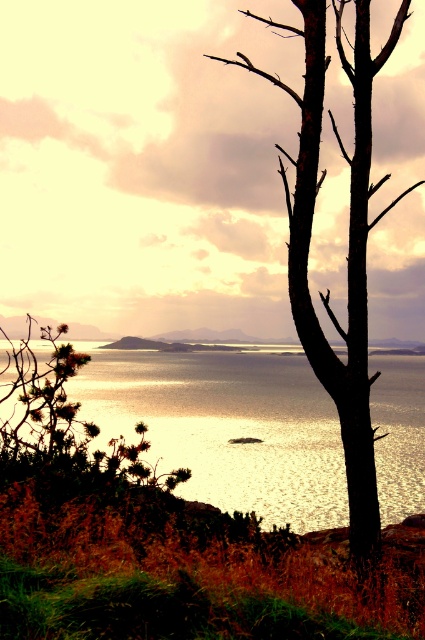
You are standing at the point marked by coordinates point (226, 428) in the coastal landscape scene. What do you see around you?

You are standing at the point marked by coordinates point (226, 428), which marks glistening reflective water at center. The water reflects the warm golden hues of the sky and the silhouette of the prominent dark trunk tree and the smaller green bush to the left of it.

You are standing at the point with coordinates point (x=345, y=448) and want to walk towards the horizon. Will the point point (x=240, y=477) block your view?

Point (x=240, y=477) is behind point (x=345, y=448), so it will not block your view.

You are a photographer trying to capture the reflection of the black bark tree at right in the glistening reflective water at center. Based on the scene, is the tree positioned in a way that its reflection would be visible in the water?

The glistening reflective water at center is located below the black bark tree at right, so the tree is positioned above the water. This means its reflection would be visible in the water as reflections typically appear below the object.